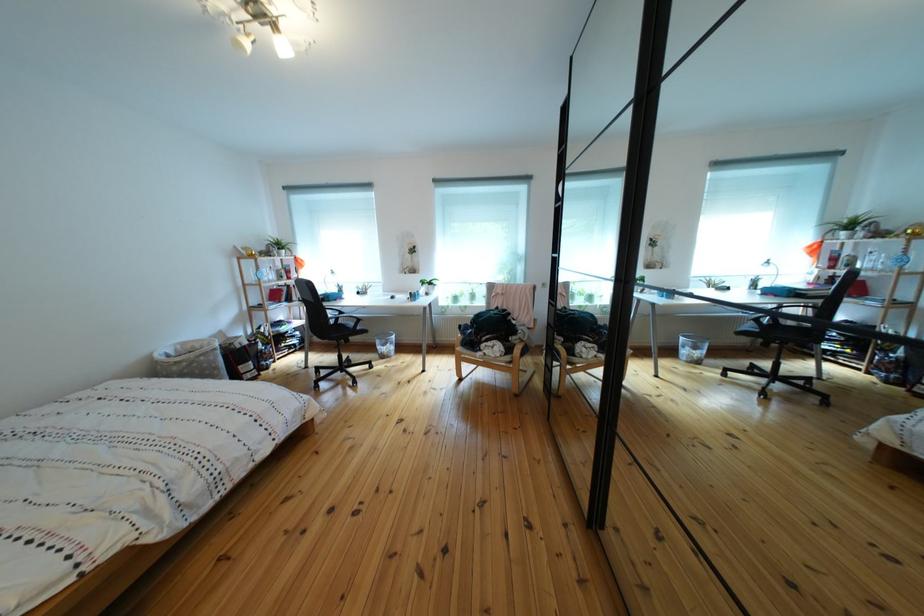
What do you see at coordinates (250, 23) in the screenshot? I see `the ceiling spotlight` at bounding box center [250, 23].